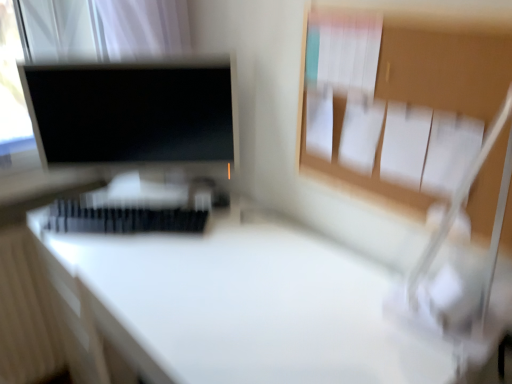
Identify the location of blank space above white plastic keyboard at center (from a real-world perspective). tap(122, 218).